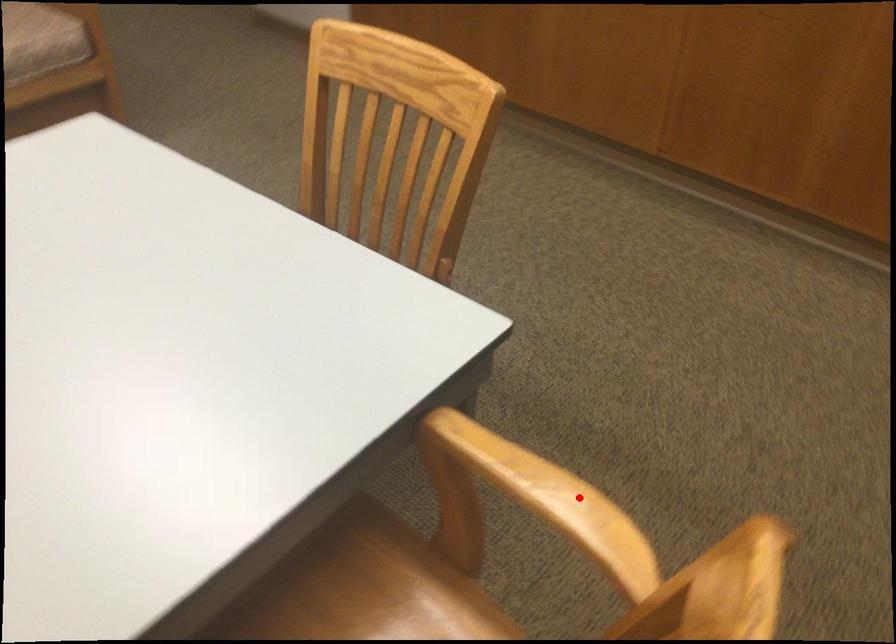
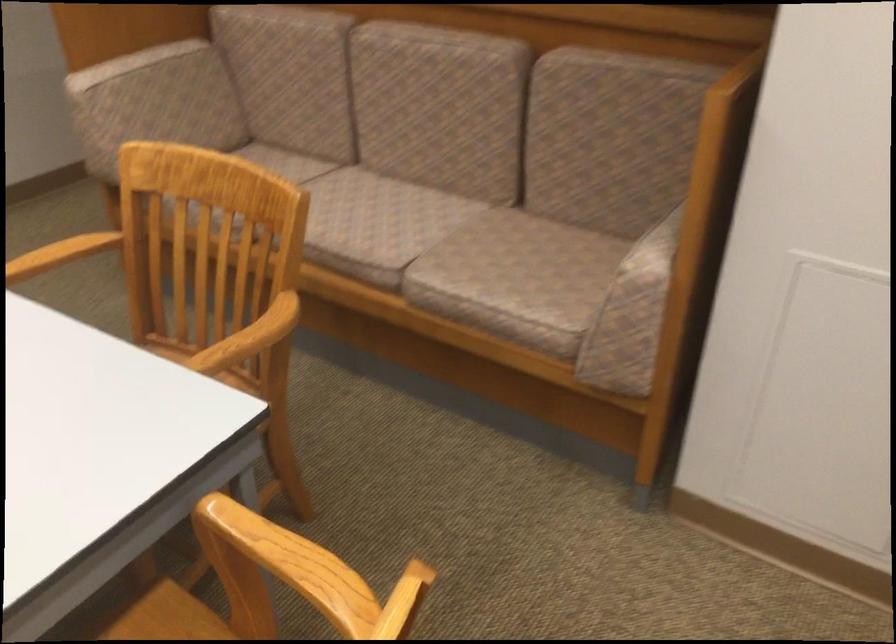
The point at the highlighted location is marked in the first image. Where is the corresponding point in the second image?

(62, 252)